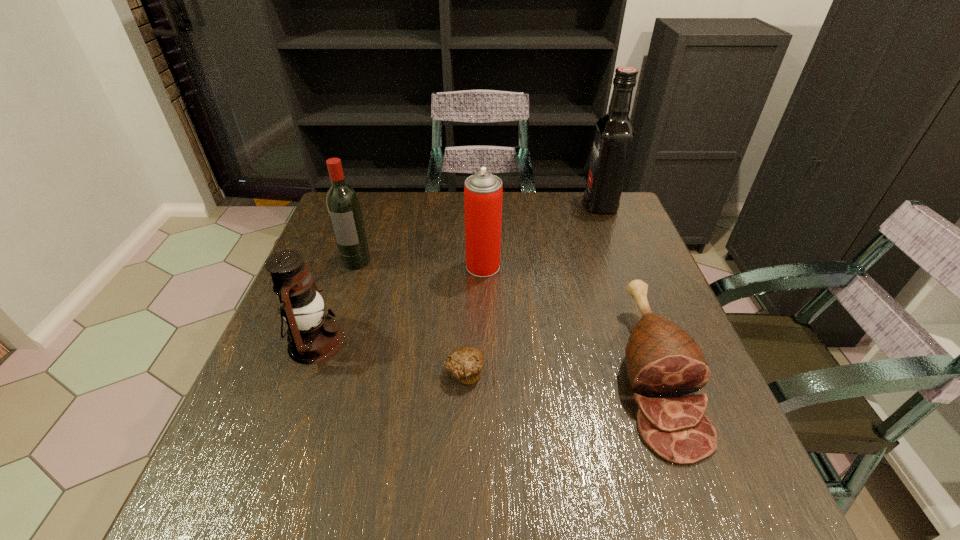
Where is `vacant space at the far edge`? vacant space at the far edge is located at coordinates (386, 231).

Identify the location of free space at the near edge of the desktop. The height and width of the screenshot is (540, 960). (634, 507).

Find the location of a particular element. vacant space at the left edge of the desktop is located at coordinates (272, 397).

Locate an element on the screen. free point at the right edge is located at coordinates [x=626, y=335].

Identify the location of free spot at the far left corner of the desktop. (329, 219).

Image resolution: width=960 pixels, height=540 pixels. Find the location of `vacant space at the far right corner`. vacant space at the far right corner is located at coordinates (584, 213).

At what (x,y) coordinates should I click in order to perform the action: click on blank region between the aerosol can and the liquor. Please return your answer as a coordinate pair (x, y). The image size is (960, 540). Looking at the image, I should click on (541, 235).

Find the location of a particular element. This screenshot has width=960, height=540. empty space that is in between the aerosol can and the shortest object is located at coordinates (473, 319).

The height and width of the screenshot is (540, 960). In order to click on free spot between the shortest object and the ham in this screenshot , I will do `click(559, 373)`.

At what (x,y) coordinates should I click in order to perform the action: click on free spot between the ham and the aerosol can. Please return your answer as a coordinate pair (x, y). Looking at the image, I should click on (568, 320).